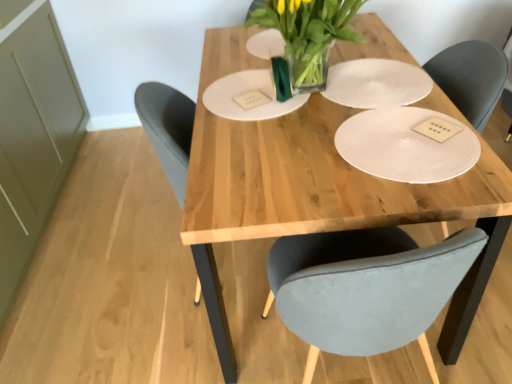
Question: From a real-world perspective, is natural wood table at center beneath white matte paper plate at center, which is counted as the 1th paper plate, starting from the left?

Choices:
 (A) no
 (B) yes

Answer: (B)

Question: Is natural wood table at center positioned before white matte paper plate at center, which appears as the 2th paper plate when viewed from the right?

Choices:
 (A) no
 (B) yes

Answer: (B)

Question: Is natural wood table at center touching white matte paper plate at center, which appears as the 2th paper plate when viewed from the right?

Choices:
 (A) yes
 (B) no

Answer: (B)

Question: Is natural wood table at center bigger than white matte paper plate at center, which is counted as the 1th paper plate, starting from the left?

Choices:
 (A) yes
 (B) no

Answer: (A)

Question: From the image's perspective, is natural wood table at center under white matte paper plate at center, which is counted as the 1th paper plate, starting from the left?

Choices:
 (A) no
 (B) yes

Answer: (B)

Question: In terms of width, does translucent glass vase at center look wider or thinner when compared to white textured paper plate at center, placed as the second paper plate when sorted from left to right?

Choices:
 (A) wide
 (B) thin

Answer: (B)

Question: Considering their positions, is translucent glass vase at center located in front of or behind white textured paper plate at center, placed as the second paper plate when sorted from left to right?

Choices:
 (A) front
 (B) behind

Answer: (A)

Question: From a real-world perspective, is translucent glass vase at center physically located above or below white textured paper plate at center, the first paper plate in the right-to-left sequence?

Choices:
 (A) below
 (B) above

Answer: (B)

Question: Considering the positions of point (310, 1) and point (376, 59), is point (310, 1) closer or farther from the camera than point (376, 59)?

Choices:
 (A) closer
 (B) farther

Answer: (A)

Question: Considering the positions of natural wood table at center and white textured plate at center in the image, is natural wood table at center taller or shorter than white textured plate at center?

Choices:
 (A) short
 (B) tall

Answer: (B)

Question: Is natural wood table at center bigger or smaller than white textured plate at center?

Choices:
 (A) big
 (B) small

Answer: (A)

Question: From a real-world perspective, is natural wood table at center physically located above or below white textured plate at center?

Choices:
 (A) above
 (B) below

Answer: (B)

Question: Is point (461, 117) closer or farther from the camera than point (428, 165)?

Choices:
 (A) closer
 (B) farther

Answer: (B)

Question: From a real-world perspective, relative to white textured paper plate at center, the first paper plate in the right-to-left sequence, is natural wood table at center vertically above or below?

Choices:
 (A) above
 (B) below

Answer: (B)

Question: In the image, is natural wood table at center positioned in front of or behind white textured paper plate at center, the first paper plate in the right-to-left sequence?

Choices:
 (A) front
 (B) behind

Answer: (A)